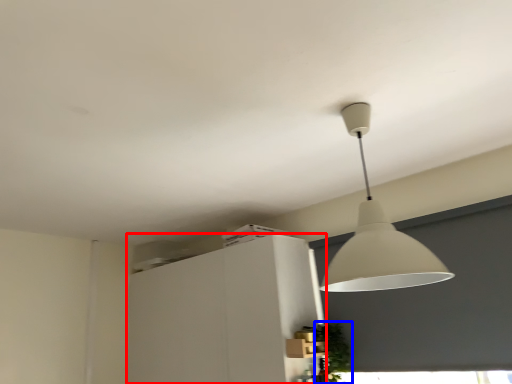
Question: Which point is closer to the camera, cabinetry (highlighted by a red box) or plant (highlighted by a blue box)?

Choices:
 (A) cabinetry
 (B) plant

Answer: (B)